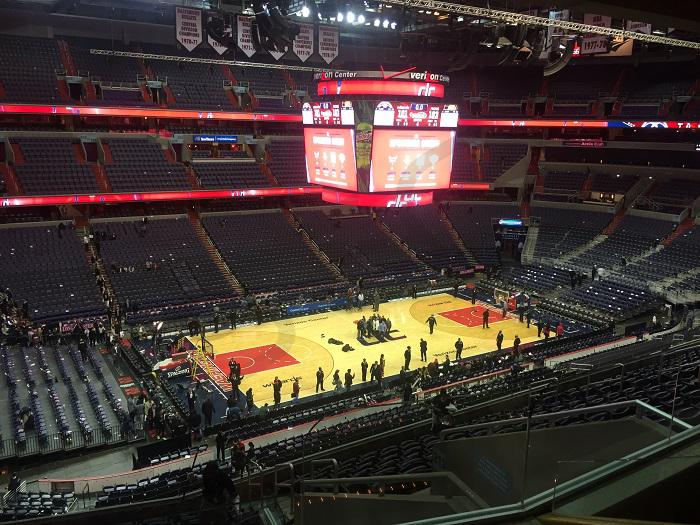
In order to click on screens in this screenshot , I will do `click(327, 160)`, `click(430, 155)`.